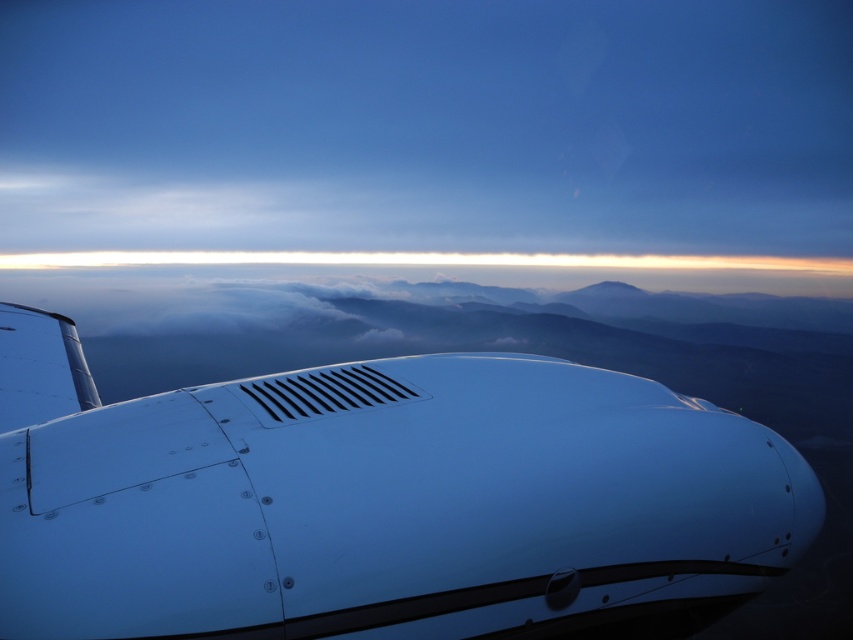
You are a passenger sitting in the aircraft and looking out the window. You see the metallic blue airplane at lower left and the metallic vent at center. Which object is nearer to your seat?

The metallic blue airplane at lower left is closer to the viewer than the metallic vent at center, so the metallic blue airplane at lower left is nearer to your seat.

You are a flight attendant who needs to locate the emergency exit sign. You see the metallic blue airplane at lower left and the metallic vent at center. Which object is closer to the emergency exit sign based on their sizes?

The metallic blue airplane at lower left has a larger size compared to the metallic vent at center, so it is closer to the emergency exit sign.

You are a pilot looking at the aircraft engine and wing from an aerial view. There is a point marked at coordinates [381,504]. Based on the scene description, what object does this point most likely belong to?

The point at coordinates [381,504] corresponds to the metallic blue airplane at lower left.